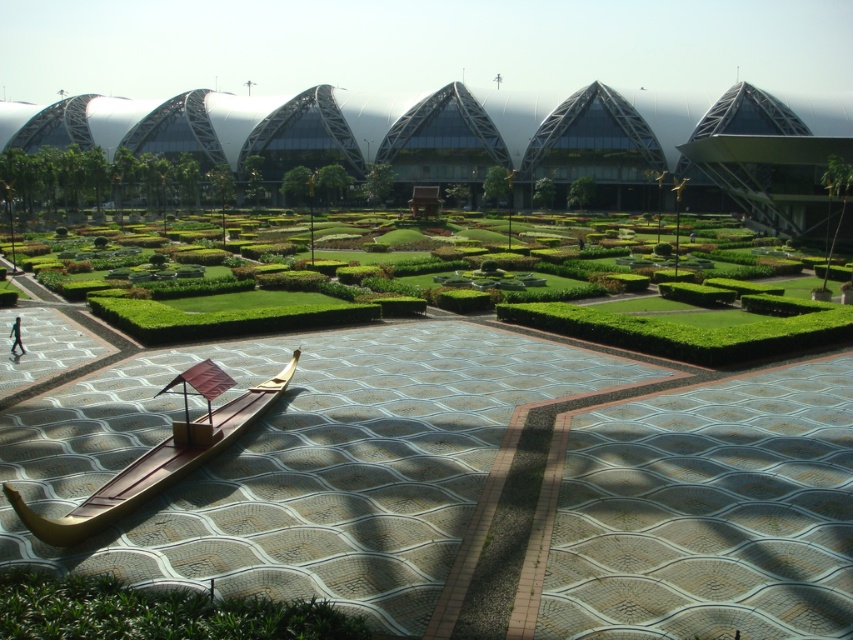
You are standing in the garden area and want to take a photo of the skinny person at center. However, the green leafy hedge at lower left is blocking your view. Can you move to the right side of the hedge to get a clear shot?

The green leafy hedge at lower left is closer to the viewer than the skinny person at center, so moving to the right side of the hedge would allow you to see around it and get a clear view of the skinny person at center.

You are standing at the entrance of the garden and see the wooden boat at lower left and the skinny person at center. Which object is closer to you?

The wooden boat at lower left is closer to you because it is in front of the skinny person at center.